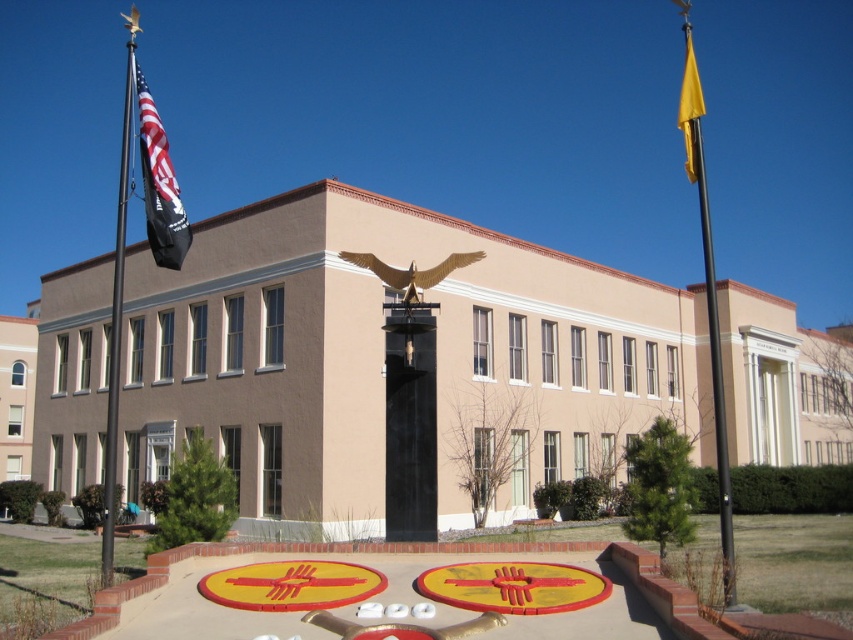
Question: Can you confirm if matte black flag at left is bigger than gold metallic eagle at center?

Choices:
 (A) yes
 (B) no

Answer: (A)

Question: Does black metal flag pole at upper right have a larger size compared to matte black flag at left?

Choices:
 (A) yes
 (B) no

Answer: (A)

Question: Is matte black flag at left thinner than gold metallic eagle at center?

Choices:
 (A) no
 (B) yes

Answer: (A)

Question: Which point is closer to the camera taking this photo?

Choices:
 (A) (688, 161)
 (B) (149, 166)
 (C) (686, 20)

Answer: (B)

Question: Estimate the real-world distances between objects in this image. Which object is closer to the matte black flag at left?

Choices:
 (A) black metal flag pole at left
 (B) gold metallic eagle at center

Answer: (A)

Question: Among these objects, which one is farthest from the camera?

Choices:
 (A) black metal flag pole at upper right
 (B) matte black flag at left
 (C) black metal flag pole at left
 (D) yellow fabric flag at upper right

Answer: (D)